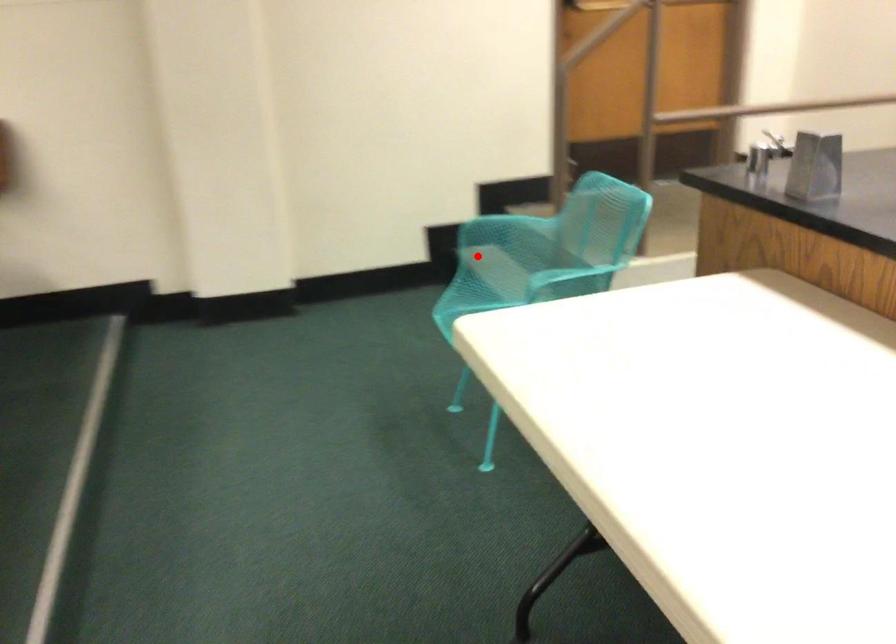
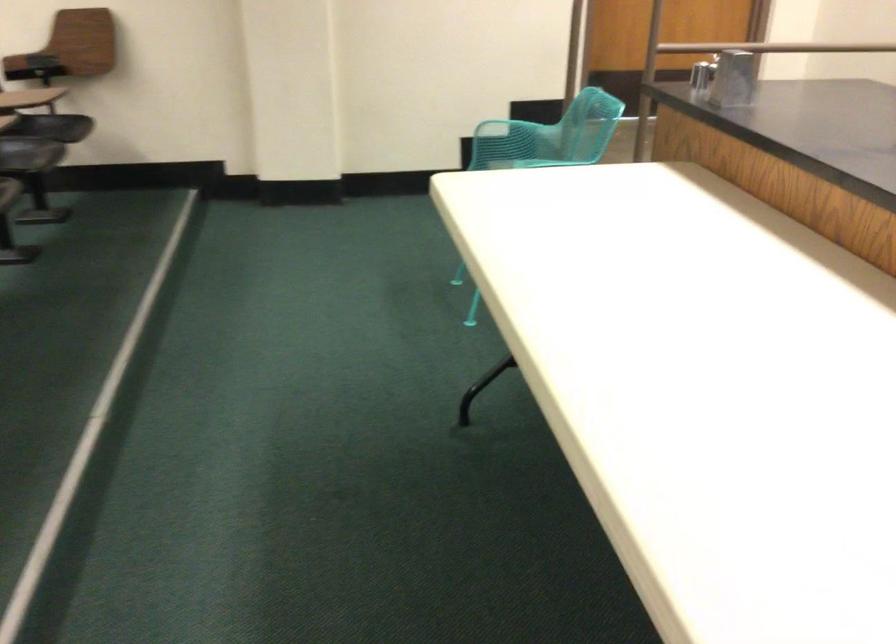
The point at the highlighted location is marked in the first image. Where is the corresponding point in the second image?

(489, 158)